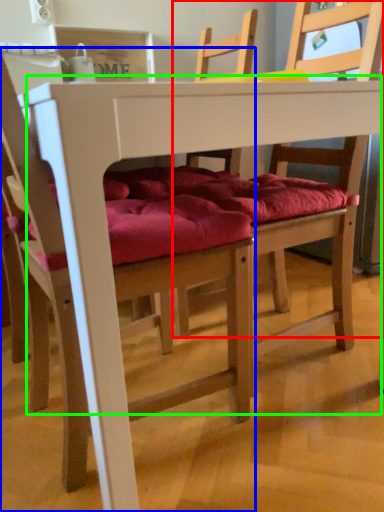
Question: Which object is the closest to the chair (highlighted by a red box)? Choose among these: chair (highlighted by a blue box) or table (highlighted by a green box).

Choices:
 (A) chair
 (B) table

Answer: (A)